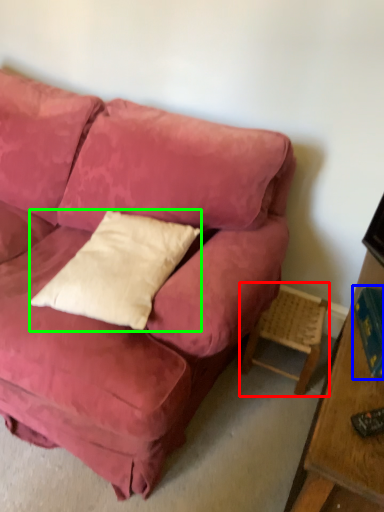
Question: Considering the real-world distances, which object is farthest from side table (highlighted by a red box)? book (highlighted by a blue box) or pillow (highlighted by a green box)?

Choices:
 (A) book
 (B) pillow

Answer: (B)